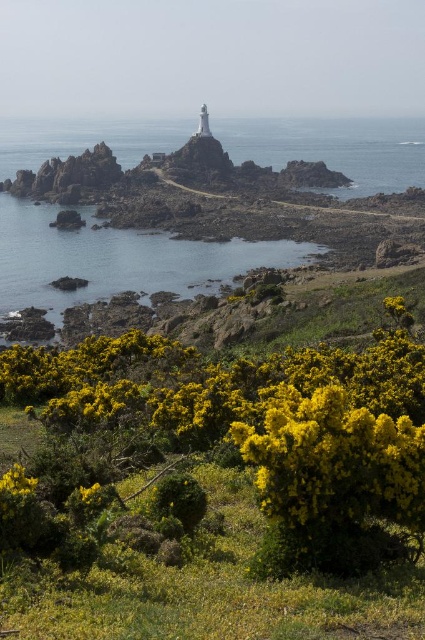
Question: Is transparent blue water at center to the right of yellow matte flower at lower center from the viewer's perspective?

Choices:
 (A) no
 (B) yes

Answer: (A)

Question: Does yellow textured bush at lower left lie behind yellow matte flower at lower center?

Choices:
 (A) yes
 (B) no

Answer: (B)

Question: Does yellow fluffy bush at lower center appear on the right side of yellow textured bush at lower left?

Choices:
 (A) no
 (B) yes

Answer: (B)

Question: Based on their relative distances, which object is farther from the yellow matte flower at lower center?

Choices:
 (A) yellow textured bush at lower left
 (B) transparent blue water at center

Answer: (B)

Question: Which of the following is the closest to the observer?

Choices:
 (A) (184, 385)
 (B) (101, 492)
 (C) (393, 300)
 (D) (342, 145)

Answer: (B)

Question: Which of the following is the farthest from the observer?

Choices:
 (A) (101, 488)
 (B) (261, 486)

Answer: (A)